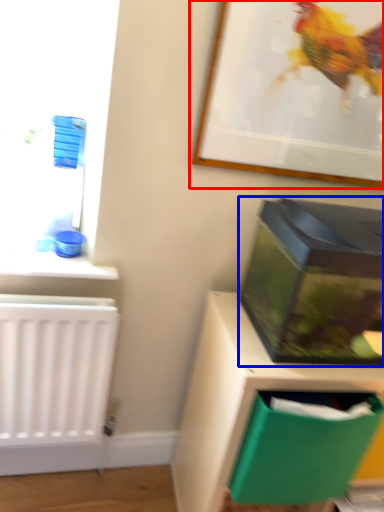
Question: Which object appears closest to the camera in this image, picture frame (highlighted by a red box) or box (highlighted by a blue box)?

Choices:
 (A) picture frame
 (B) box

Answer: (B)